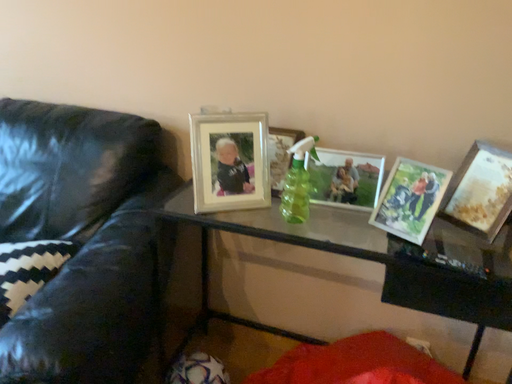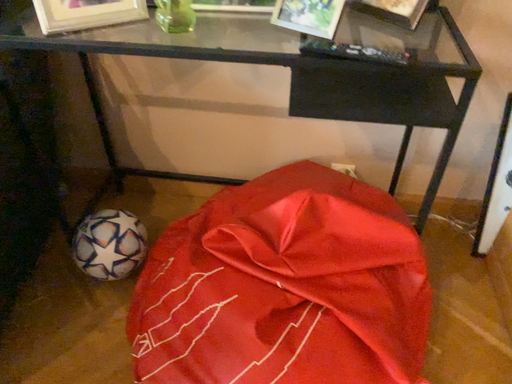
Question: How did the camera likely rotate when shooting the video?

Choices:
 (A) rotated downward
 (B) rotated upward

Answer: (A)